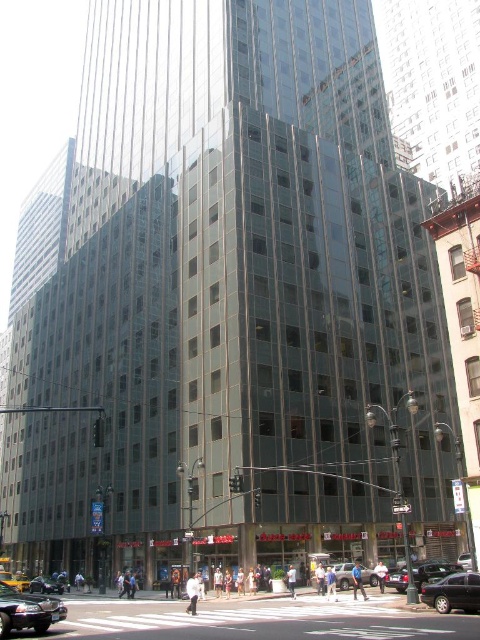
Which of these two, shiny black sedan at lower left or silver metallic suv at center, stands shorter?

silver metallic suv at center is shorter.

Is shiny black sedan at lower left below silver metallic suv at center?

No, shiny black sedan at lower left is not below silver metallic suv at center.

Is point (60, 618) positioned after point (336, 563)?

No, it is not.

The width and height of the screenshot is (480, 640). Identify the location of shiny black sedan at lower left. (27, 611).

Can you confirm if shiny black sedan at center is thinner than black glossy sedan at center?

No, shiny black sedan at center is not thinner than black glossy sedan at center.

Image resolution: width=480 pixels, height=640 pixels. What are the coordinates of `shiny black sedan at center` in the screenshot? It's located at (453, 593).

Identify the location of shiny black sedan at center. (453, 593).

Is metallic silver sedan at center thinner than yellow rubber taxi at lower left?

Yes, metallic silver sedan at center is thinner than yellow rubber taxi at lower left.

Which is behind, point (400, 577) or point (26, 589)?

Point (26, 589)

In order to click on metallic silver sedan at center in this screenshot , I will do `click(432, 572)`.

This screenshot has width=480, height=640. What are the coordinates of `metallic silver sedan at center` in the screenshot? It's located at (432, 572).